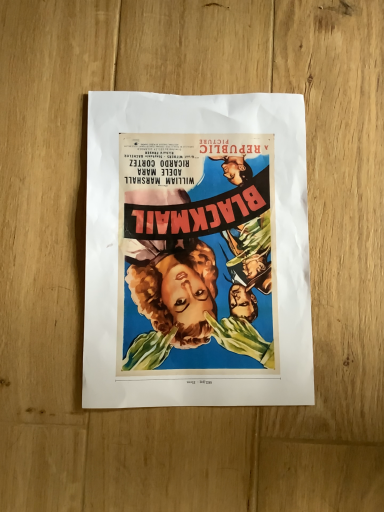
Where is `free space above matte paper poster at center (from a real-world perspective)`? The width and height of the screenshot is (384, 512). free space above matte paper poster at center (from a real-world perspective) is located at coordinates [x=201, y=241].